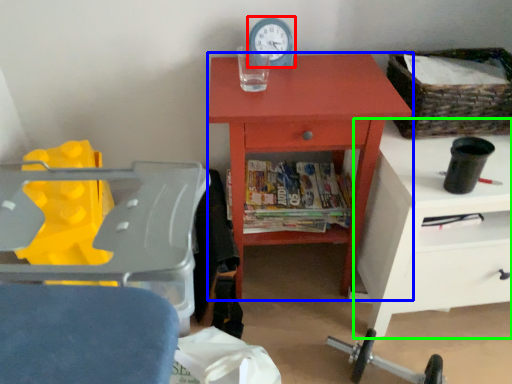
Question: Estimate the real-world distances between objects in this image. Which object is closer to clock (highlighted by a red box), chest of drawers (highlighted by a blue box) or nightstand (highlighted by a green box)?

Choices:
 (A) chest of drawers
 (B) nightstand

Answer: (A)